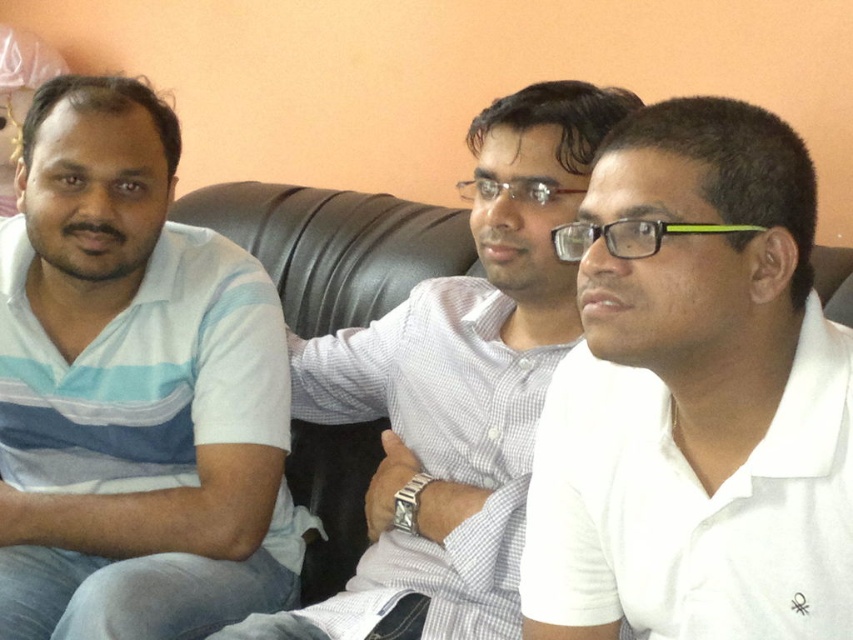
You are a photographer setting up for a group portrait. You need to ensure that the white matte shirt at center and the white checkered shirt at center are at least 12 inches apart to avoid overlapping in the photo. Based on the scene description, will their current positions meet this requirement?

The white matte shirt at center and the white checkered shirt at center are 13.06 inches apart from each other, which exceeds the minimum requirement of 12 inches. Therefore, their current positions meet the requirement.